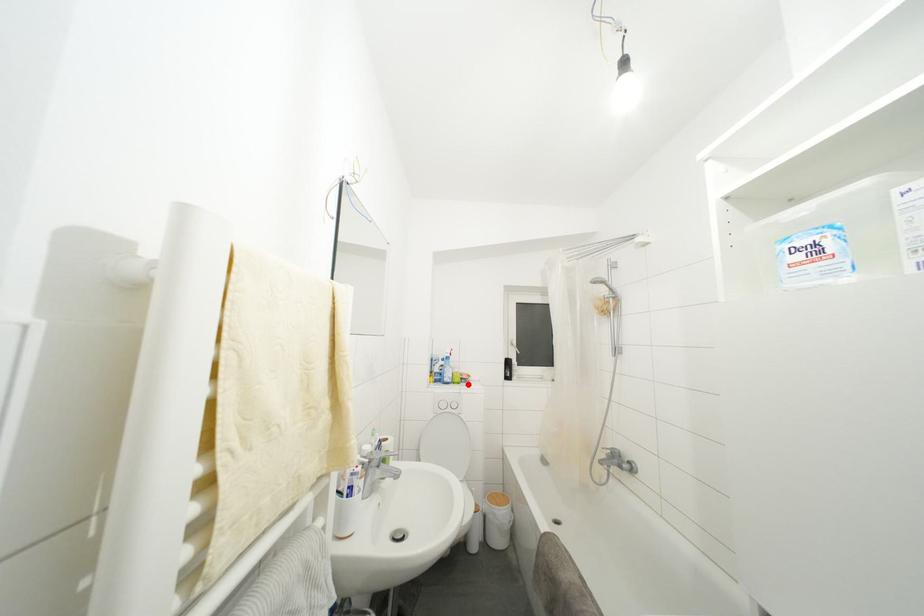
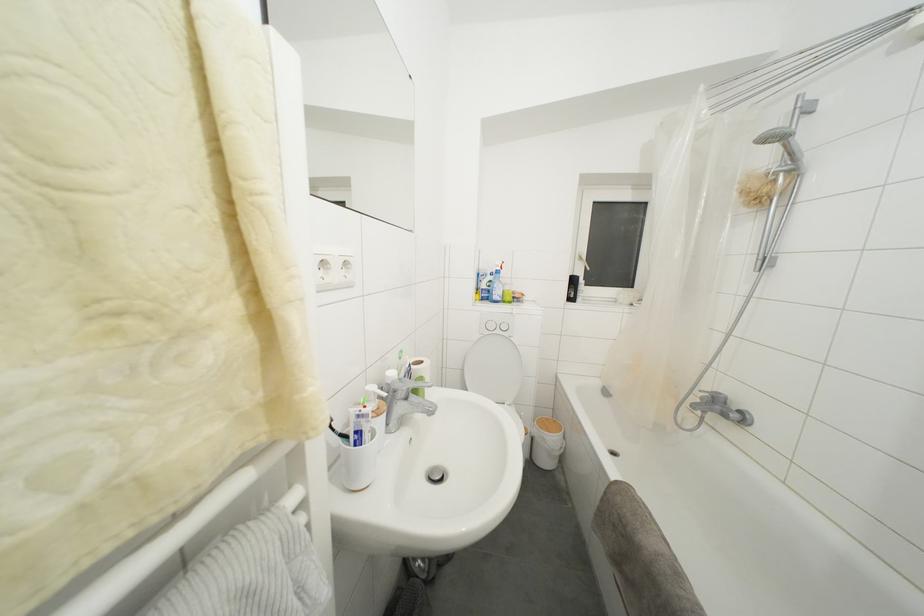
Find the pixel in the second image that matches the highlighted location in the first image.

(520, 304)